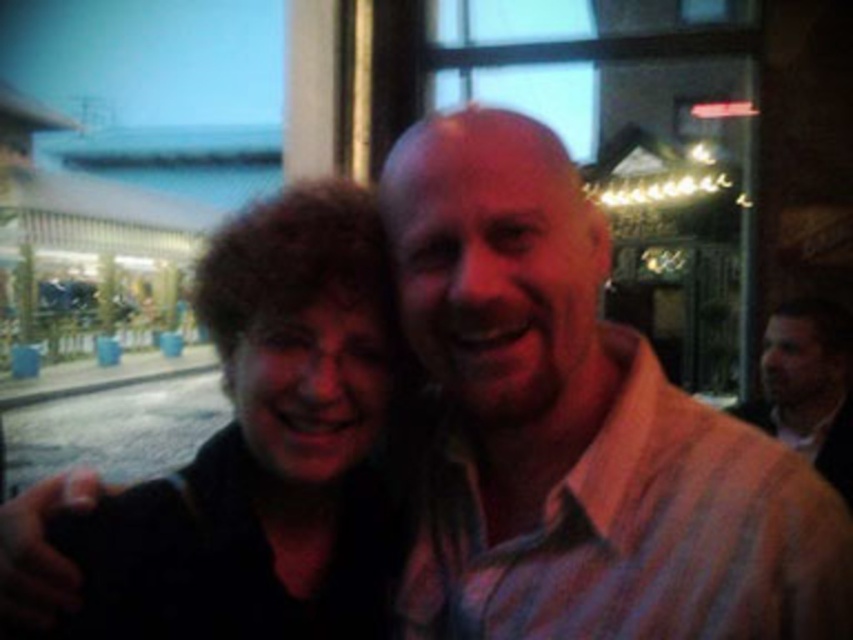
You are a photographer standing 36 inches away from the dark brown hair at left. Can you comfortably take a photo without moving closer?

The dark brown hair at left is 33.66 inches away from the viewer, so you are already 36 inches away, which is slightly further than the distance of the subject. You might need to move closer to 33.66 inches to capture a clear photo.

You are a photographer standing in front of the two people in the image. You want to take a photo that includes both the dark brown hair at left and the light brown textured shirt at right without moving either of them. What is the minimum distance you need to step back to ensure both are fully visible in your camera frame?

The minimum distance you need to step back is 5.43 feet. Since the dark brown hair at left is 5.43 feet away from the light brown textured shirt at right, stepping back to that distance ensures both are within the camera frame without needing to move them.

You are a photographer trying to capture a closeup of the dark brown hair at left without the light brown textured shirt at right appearing in the frame. Is this possible given their positions?

The dark brown hair at left is in front of the light brown textured shirt at right, so it is possible to capture a closeup of the dark brown hair at left without the light brown textured shirt at right appearing in the frame by focusing on the foreground.